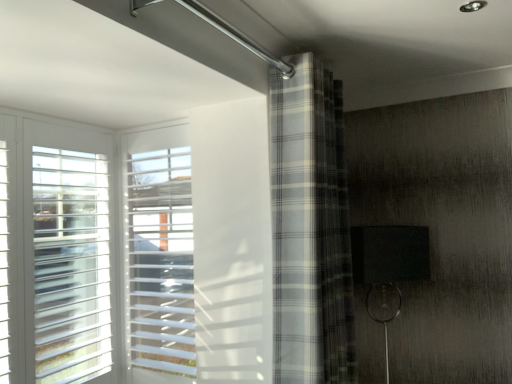
Question: Should I look upward or downward to see gray plaid curtain at center?

Choices:
 (A) up
 (B) down

Answer: (B)

Question: Does gray plaid curtain at center have a lesser width compared to white plastic blinds at left?

Choices:
 (A) no
 (B) yes

Answer: (A)

Question: From the image's perspective, is gray plaid curtain at center on white plastic blinds at left?

Choices:
 (A) no
 (B) yes

Answer: (B)

Question: Considering the relative sizes of gray plaid curtain at center and white plastic blinds at left in the image provided, is gray plaid curtain at center smaller than white plastic blinds at left?

Choices:
 (A) no
 (B) yes

Answer: (A)

Question: Is gray plaid curtain at center positioned before white plastic blinds at left?

Choices:
 (A) no
 (B) yes

Answer: (B)

Question: Is gray plaid curtain at center wider than white plastic blinds at left?

Choices:
 (A) no
 (B) yes

Answer: (B)

Question: Is gray plaid curtain at center aimed at white plastic blinds at left?

Choices:
 (A) yes
 (B) no

Answer: (B)

Question: Is gray plaid curtain at center surrounded by white plastic blinds at left?

Choices:
 (A) no
 (B) yes

Answer: (A)

Question: Can you see white plastic blinds at left touching gray plaid curtain at center?

Choices:
 (A) no
 (B) yes

Answer: (A)

Question: Is white plastic blinds at left oriented towards gray plaid curtain at center?

Choices:
 (A) no
 (B) yes

Answer: (A)

Question: Considering the relative positions of white plastic blinds at left and gray plaid curtain at center in the image provided, is white plastic blinds at left behind gray plaid curtain at center?

Choices:
 (A) no
 (B) yes

Answer: (B)

Question: From the image's perspective, is white plastic blinds at left below gray plaid curtain at center?

Choices:
 (A) no
 (B) yes

Answer: (B)

Question: Can you confirm if white plastic blinds at left is shorter than gray plaid curtain at center?

Choices:
 (A) no
 (B) yes

Answer: (B)

Question: From the image's perspective, is gray plaid curtain at center above or below white plastic blinds at left?

Choices:
 (A) below
 (B) above

Answer: (B)